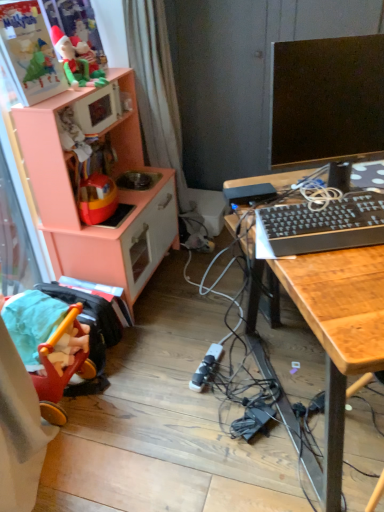
Question: Can you confirm if black glossy monitor at upper right is bigger than black plastic keyboard at right?

Choices:
 (A) no
 (B) yes

Answer: (B)

Question: Considering the relative sizes of black glossy monitor at upper right and black plastic keyboard at right in the image provided, is black glossy monitor at upper right smaller than black plastic keyboard at right?

Choices:
 (A) no
 (B) yes

Answer: (A)

Question: From a real-world perspective, is black glossy monitor at upper right physically below black plastic keyboard at right?

Choices:
 (A) no
 (B) yes

Answer: (A)

Question: Is black glossy monitor at upper right beside black plastic keyboard at right?

Choices:
 (A) yes
 (B) no

Answer: (B)

Question: Is black glossy monitor at upper right positioned before black plastic keyboard at right?

Choices:
 (A) no
 (B) yes

Answer: (B)

Question: Is black glossy monitor at upper right not inside black plastic keyboard at right?

Choices:
 (A) no
 (B) yes

Answer: (B)

Question: From the image's perspective, does peach wood toy kitchen at left appear lower than black glossy monitor at upper right?

Choices:
 (A) yes
 (B) no

Answer: (A)

Question: Can you confirm if peach wood toy kitchen at left is taller than black glossy monitor at upper right?

Choices:
 (A) no
 (B) yes

Answer: (B)

Question: Is peach wood toy kitchen at left facing towards black glossy monitor at upper right?

Choices:
 (A) no
 (B) yes

Answer: (B)

Question: Is peach wood toy kitchen at left positioned beyond the bounds of black glossy monitor at upper right?

Choices:
 (A) no
 (B) yes

Answer: (B)

Question: Can you confirm if peach wood toy kitchen at left is bigger than black glossy monitor at upper right?

Choices:
 (A) yes
 (B) no

Answer: (A)

Question: Is the position of peach wood toy kitchen at left less distant than that of black glossy monitor at upper right?

Choices:
 (A) no
 (B) yes

Answer: (A)

Question: Does matte green plush toy at upper left lie behind peach wood toy kitchen at left?

Choices:
 (A) yes
 (B) no

Answer: (A)